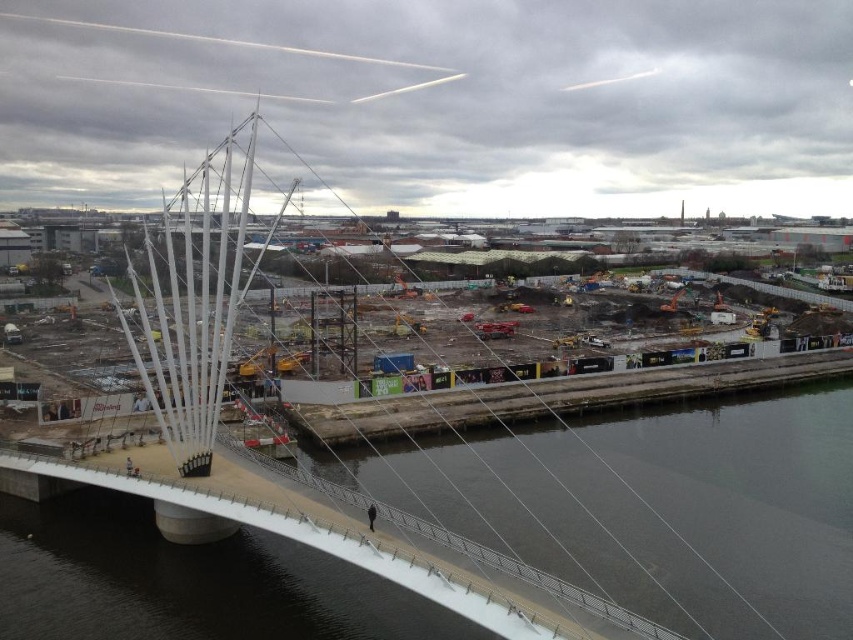
Question: Which object appears closest to the camera in this image?

Choices:
 (A) concrete construction site at center
 (B) dark gray concrete at center

Answer: (A)

Question: Which object appears closest to the camera in this image?

Choices:
 (A) concrete construction site at center
 (B) dark gray concrete at center

Answer: (A)

Question: Considering the relative positions of concrete construction site at center and dark gray concrete at center in the image provided, where is concrete construction site at center located with respect to dark gray concrete at center?

Choices:
 (A) right
 (B) left

Answer: (B)

Question: Is concrete construction site at center smaller than dark gray concrete at center?

Choices:
 (A) no
 (B) yes

Answer: (A)

Question: Which point is closer to the camera?

Choices:
 (A) concrete construction site at center
 (B) dark gray concrete at center

Answer: (A)

Question: Considering the relative positions of concrete construction site at center and dark gray concrete at center in the image provided, where is concrete construction site at center located with respect to dark gray concrete at center?

Choices:
 (A) above
 (B) below

Answer: (B)